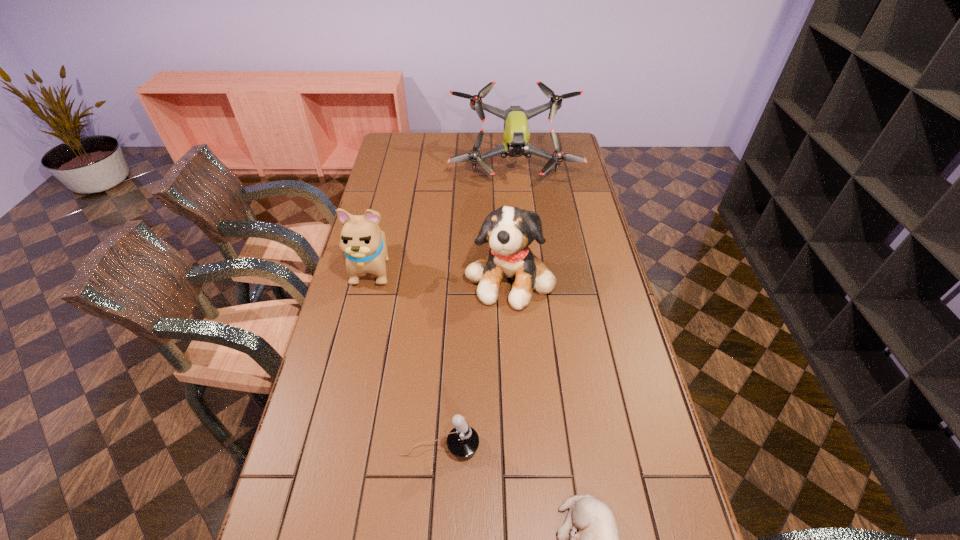
You are a GUI agent. You are given a task and a screenshot of the screen. Output one action in this format:
    pyautogui.click(x=<x>, y=<y>)
    Task: Click on the free space at the left edge
    This screenshot has width=960, height=540.
    Given the screenshot: What is the action you would take?
    [x=373, y=275]

Identify the location of blank space at the right edge of the desktop. The height and width of the screenshot is (540, 960). (575, 171).

Identify the location of vacant space at the far left corner of the desktop. (418, 133).

You are a GUI agent. You are given a task and a screenshot of the screen. Output one action in this format:
    pyautogui.click(x=<x>, y=<y>)
    Task: Click on the vacant area that lies between the farthest object and the leftmost puppy
    The width and height of the screenshot is (960, 540).
    Given the screenshot: What is the action you would take?
    pyautogui.click(x=444, y=216)

Where is `object that is the third closest to the drone`? This screenshot has width=960, height=540. object that is the third closest to the drone is located at coordinates pyautogui.click(x=463, y=441).

Where is `object that is the fourth nearest to the second nearest object`? The image size is (960, 540). object that is the fourth nearest to the second nearest object is located at coordinates (516, 135).

Identify which puppy is the closest to the farthest object. Please provide its 2D coordinates. Your answer should be formatted as a tuple, i.e. [(x, y)], where the tuple contains the x and y coordinates of a point satisfying the conditions above.

[(509, 231)]

Locate an element on the screen. This screenshot has height=540, width=960. puppy object that ranks as the second closest to the shortest puppy is located at coordinates (364, 244).